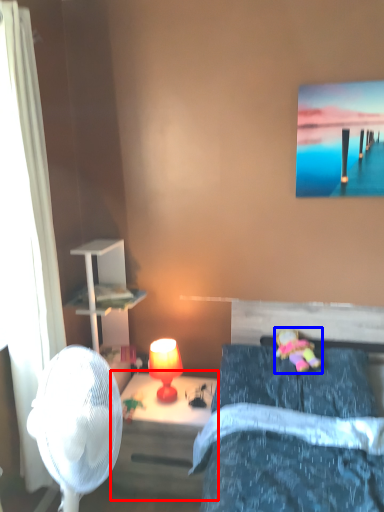
Question: Which point is further to the camera, nightstand (highlighted by a red box) or toy (highlighted by a blue box)?

Choices:
 (A) nightstand
 (B) toy

Answer: (A)